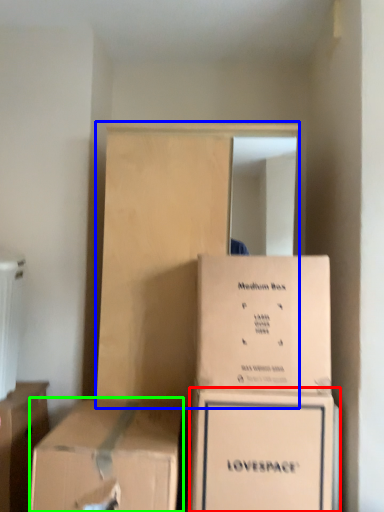
Question: Which object is the closest to the box (highlighted by a red box)? Choose among these: dresser (highlighted by a blue box) or box (highlighted by a green box).

Choices:
 (A) dresser
 (B) box

Answer: (B)